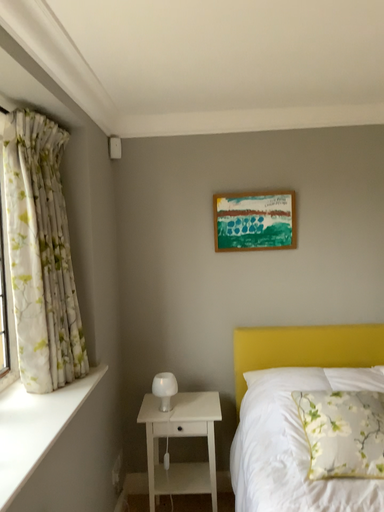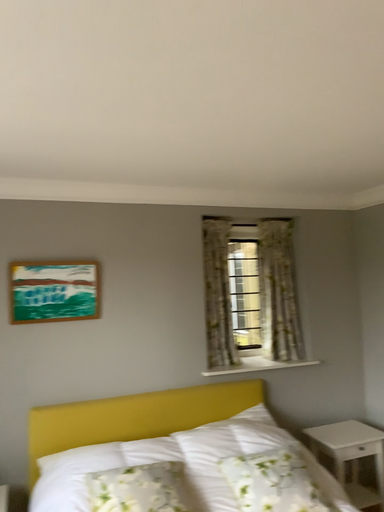
Question: Which way did the camera rotate in the video?

Choices:
 (A) rotated downward
 (B) rotated upward

Answer: (B)